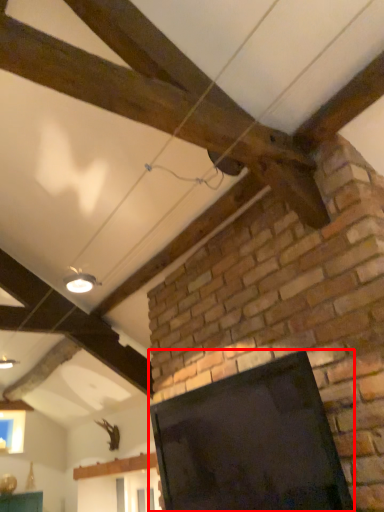
Question: Where is screen (annotated by the red box) located in relation to light fixture in the image?

Choices:
 (A) right
 (B) left

Answer: (A)